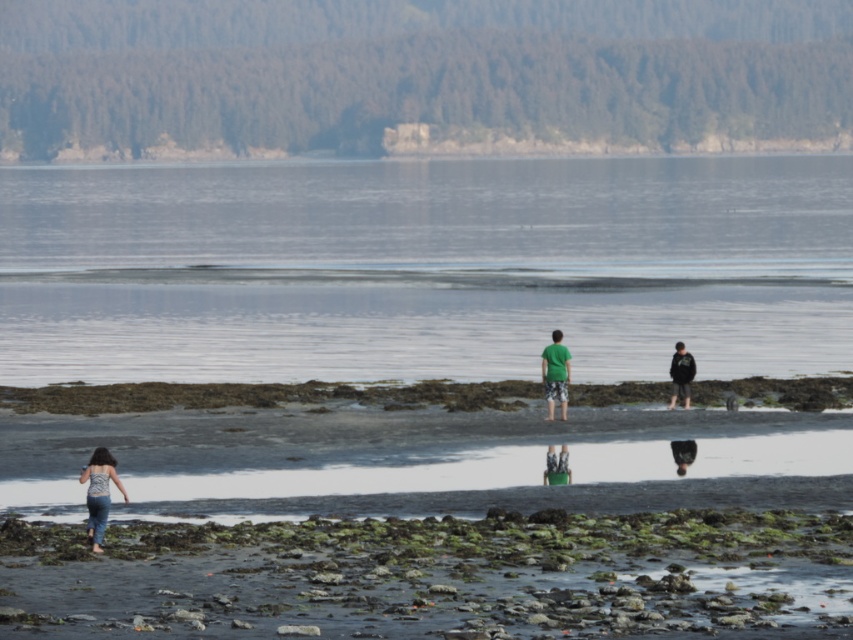
You are standing at the shoreline in the coastal scene and want to walk towards the camera. Which point, point (184, 541) or point (85, 472), is closer to you as you move forward?

Point (184, 541) is closer to you because it is further to the camera than point (85, 472), so as you move forward towards the camera, it would be nearer.

You are planning to take a photo of the clear water at center and the green fabric shirt at center from the shore. Which object will appear taller in the photo?

The clear water at center will appear taller in the photo because it has a greater height compared to the green fabric shirt at center.